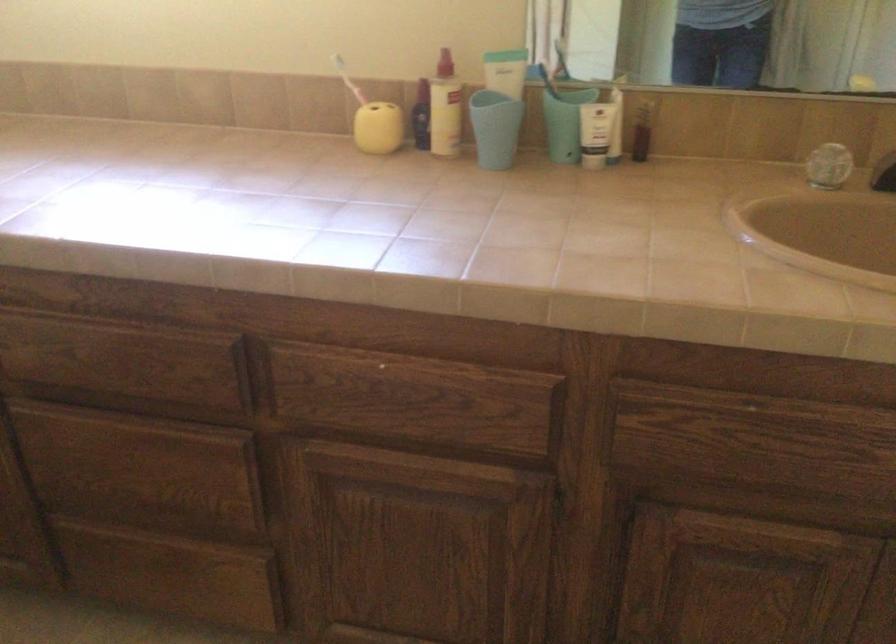
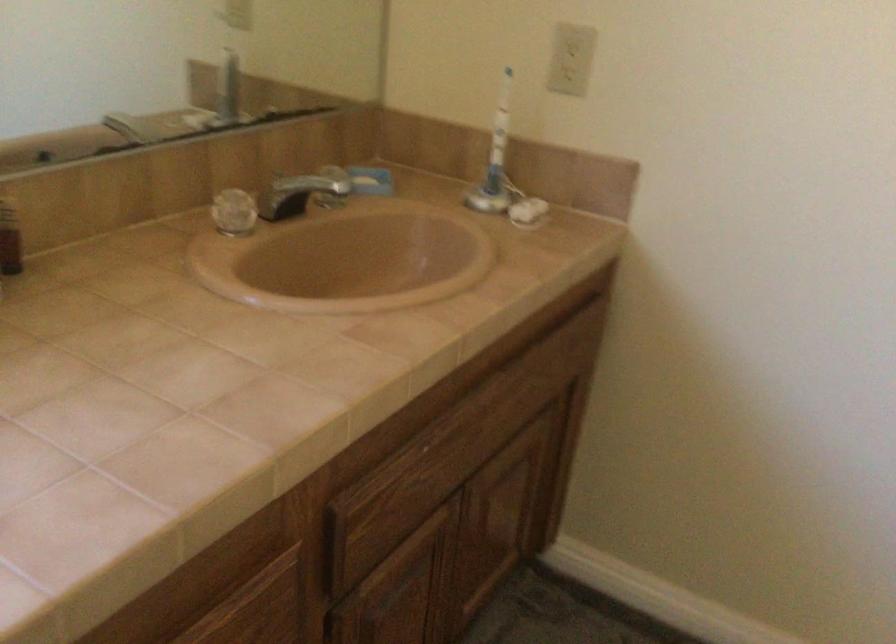
First-person continuous shooting, in which direction is the camera rotating?

The camera's rotation is toward right-down.